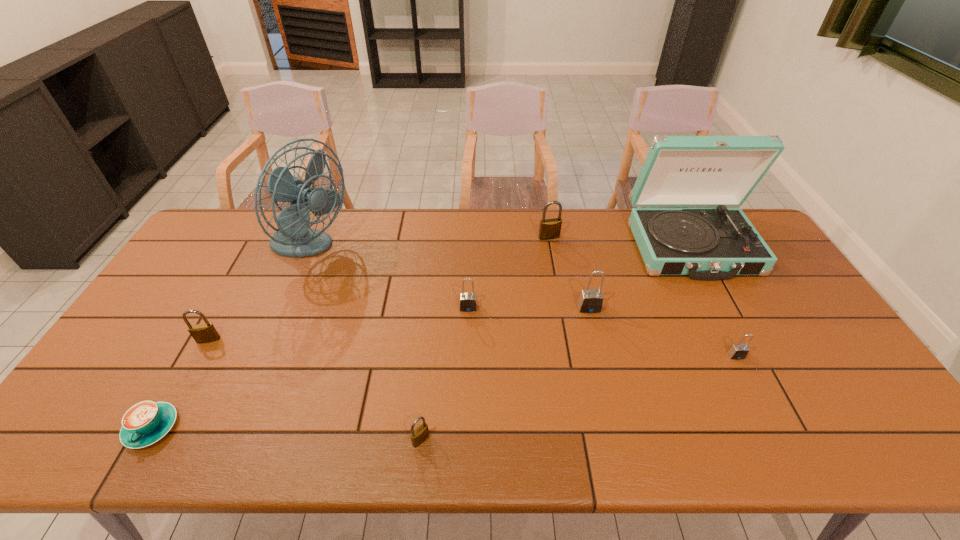
Where is `brass padlock object that ranks as the third closest to the record player`? brass padlock object that ranks as the third closest to the record player is located at coordinates (202, 333).

This screenshot has width=960, height=540. What are the coordinates of `the closest brass padlock to the cappuccino` in the screenshot? It's located at tap(202, 333).

Identify which gray padlock is located as the third nearest to the fan. Please provide its 2D coordinates. Your answer should be formatted as a tuple, i.e. [(x, y)], where the tuple contains the x and y coordinates of a point satisfying the conditions above.

[(739, 351)]

Where is `gray padlock that can be found as the closest to the rightmost brass padlock`? This screenshot has width=960, height=540. gray padlock that can be found as the closest to the rightmost brass padlock is located at coordinates (590, 301).

This screenshot has width=960, height=540. What are the coordinates of `free space that satisfies the following two spatial constraints: 1. in front of the fan to blow air; 2. with the handle on the right side of the shortest object` in the screenshot? It's located at click(x=233, y=427).